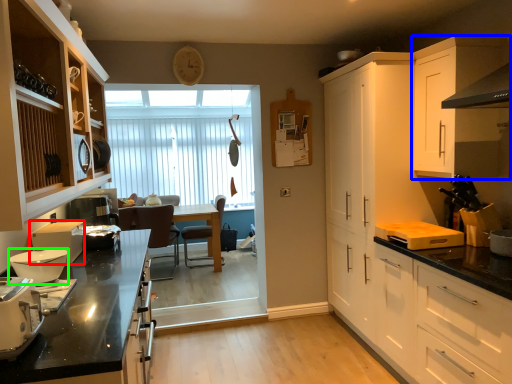
Question: Which object is the farthest from kitchen appliance (highlighted by a red box)? Choose among these: cabinetry (highlighted by a blue box) or kitchen appliance (highlighted by a green box).

Choices:
 (A) cabinetry
 (B) kitchen appliance

Answer: (A)